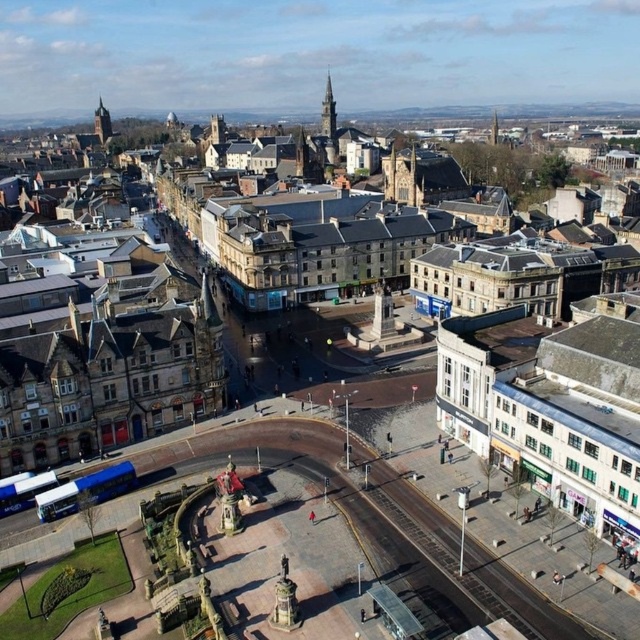
You are a tourist standing at the edge of the plaza. You want to take a photo that includes both the brown stone town at center and the smooth stone tower at upper center. Which object should you position closer to the camera to ensure both are in the frame?

You should position the brown stone town at center closer to the camera because it is in front of the smooth stone tower at upper center, allowing both to be visible in the photo.

You are a tourist standing at the center of the plaza and want to take a photo of both the smooth stone tower at upper center and the dark brown stone tower at upper left. Which tower should you look upwards to capture in your photo?

The smooth stone tower at upper center is above the dark brown stone tower at upper left, so you should look upwards to capture the smooth stone tower at upper center in your photo.

You are a tourist standing at the edge of the plaza looking towards the center. You see the brown stone town at center and the smooth stone tower at upper center. Which one is closer to your current position?

The brown stone town at center is closer to your current position because it is located below the smooth stone tower at upper center, meaning it is situated nearer to the viewer in the aerial perspective.